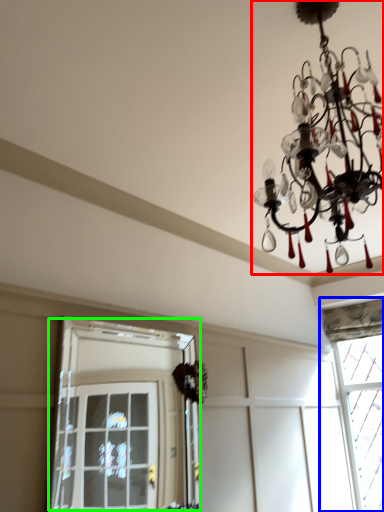
Question: Which object is the closest to the lamp (highlighted by a red box)? Choose among these: window (highlighted by a blue box) or window (highlighted by a green box).

Choices:
 (A) window
 (B) window

Answer: (A)